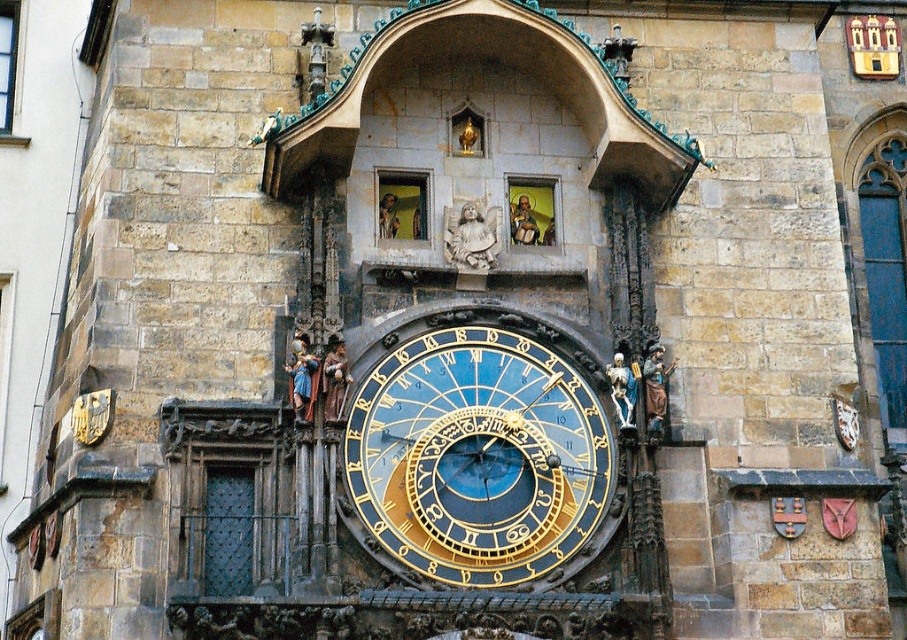
Question: Which object appears closest to the camera in this image?

Choices:
 (A) stone statue of an angel at center
 (B) gold metallic clock at center

Answer: (B)

Question: Is gold metallic clock at center further to the viewer compared to stone statue of an angel at center?

Choices:
 (A) no
 (B) yes

Answer: (A)

Question: Can you confirm if gold metallic clock at center is wider than stone statue of an angel at center?

Choices:
 (A) yes
 (B) no

Answer: (A)

Question: From the image, what is the correct spatial relationship of gold metallic clock at center in relation to stone statue of an angel at center?

Choices:
 (A) left
 (B) right

Answer: (B)